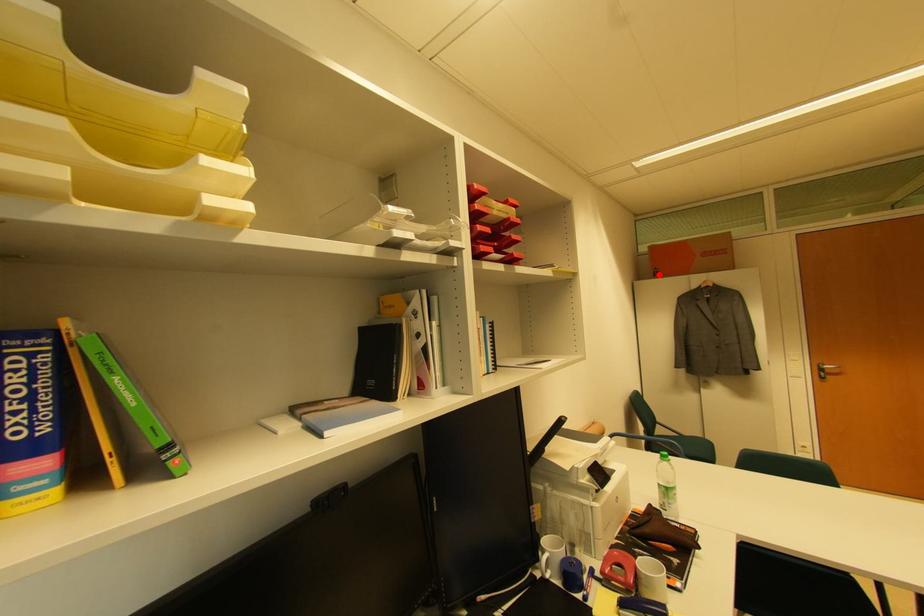
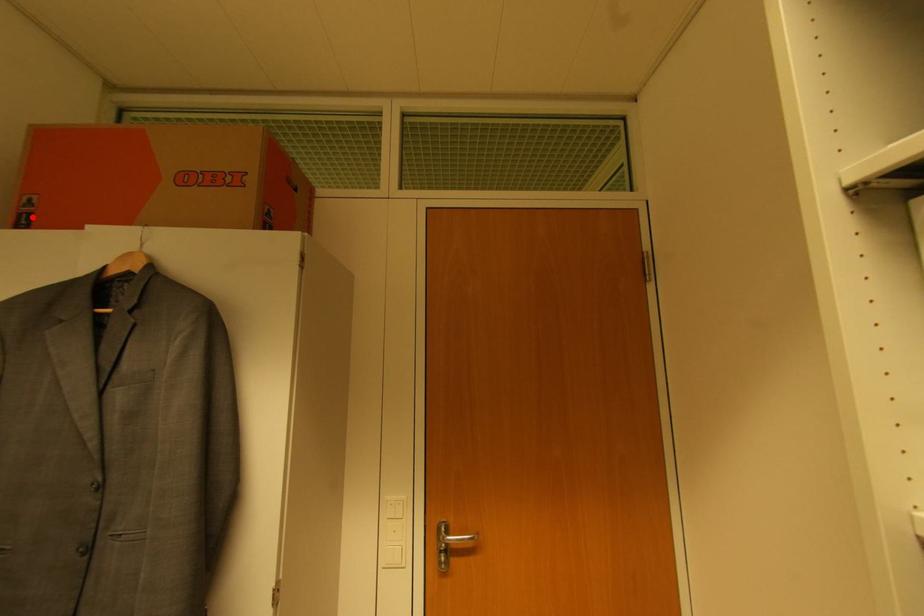
I am providing you with two images of the same scene from different viewpoints. A red point is marked on the first image and another point is marked on the second image. Is the marked point in image1 the same physical position as the marked point in image2?

Yes